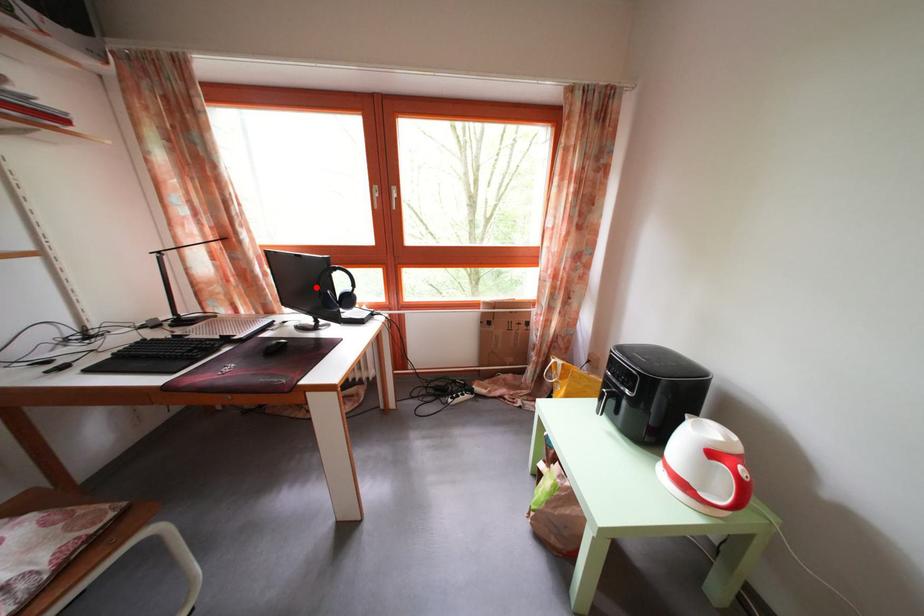
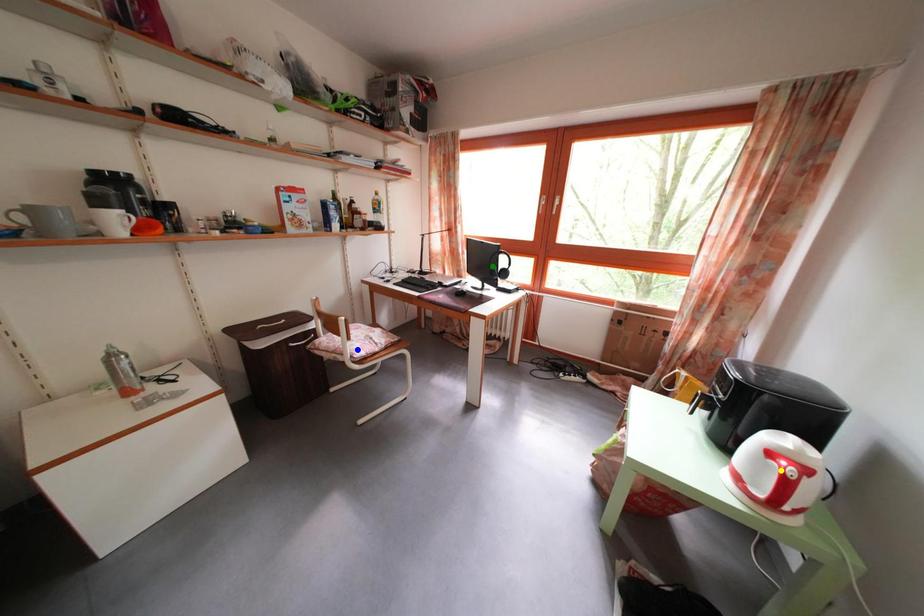
Question: I am providing you with two images of the same scene from different viewpoints. A red point is marked on the first image. You are given multiple points on the second image. Which mark in image 2 goes with the point in image 1?

Choices:
 (A) yellow point
 (B) green point
 (C) blue point

Answer: (B)